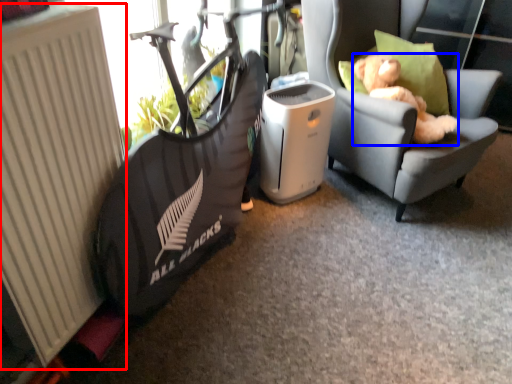
Question: Among these objects, which one is nearest to the camera, radiator (highlighted by a red box) or animal (highlighted by a blue box)?

Choices:
 (A) radiator
 (B) animal

Answer: (A)